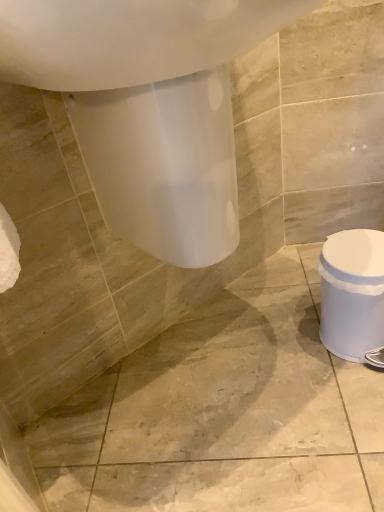
This screenshot has height=512, width=384. What do you see at coordinates (353, 295) in the screenshot?
I see `white plastic potty at right` at bounding box center [353, 295].

The width and height of the screenshot is (384, 512). In order to click on white plastic potty at right in this screenshot , I will do `click(353, 295)`.

Where is `white plastic potty at right`? This screenshot has width=384, height=512. white plastic potty at right is located at coordinates (353, 295).